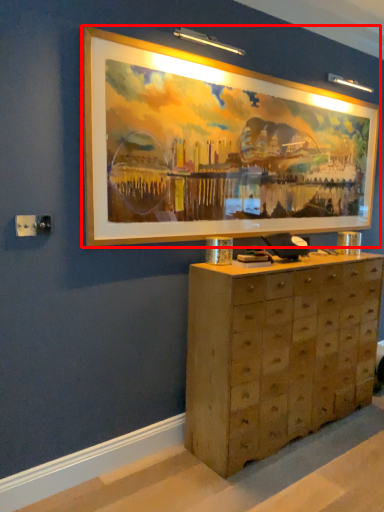
Question: From the image's perspective, what is the correct spatial positioning of picture frame (annotated by the red box) in reference to chest of drawers?

Choices:
 (A) below
 (B) above

Answer: (B)